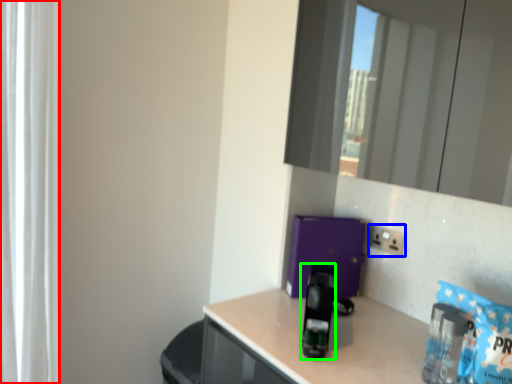
Question: Based on their relative distances, which object is nearer to curtain (highlighted by a red box)? Choose from electric outlet (highlighted by a blue box) and appliance (highlighted by a green box).

Choices:
 (A) electric outlet
 (B) appliance

Answer: (B)